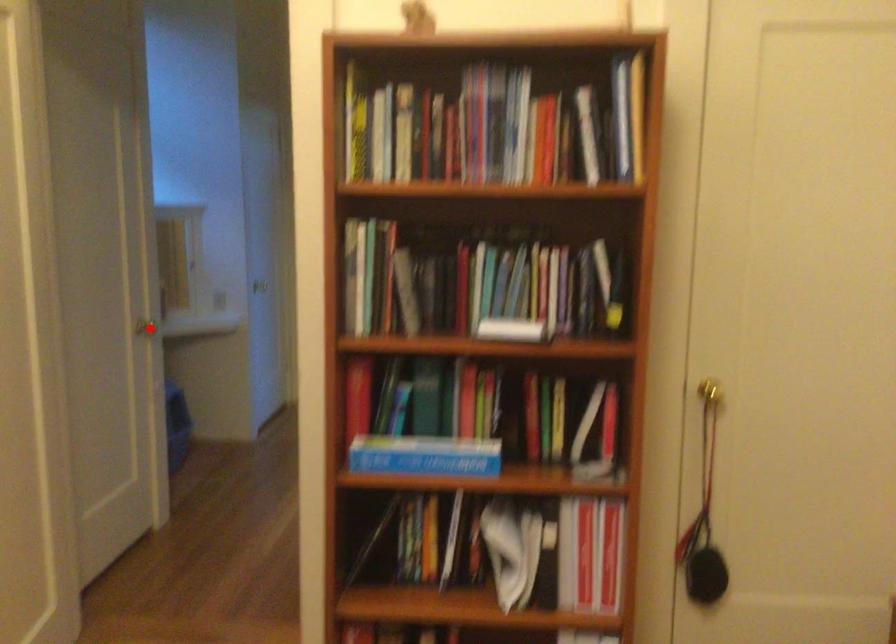
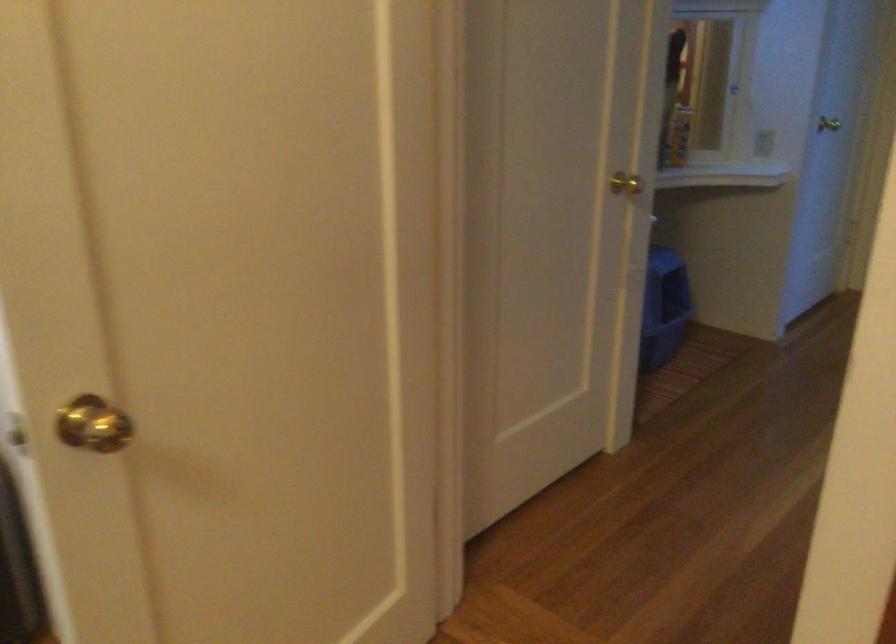
Question: I am providing you with two images of the same scene from different viewpoints. A red point is shown in image1. For the corresponding object point in image2, is it positioned nearer or farther from the camera?

Choices:
 (A) Nearer
 (B) Farther

Answer: (A)